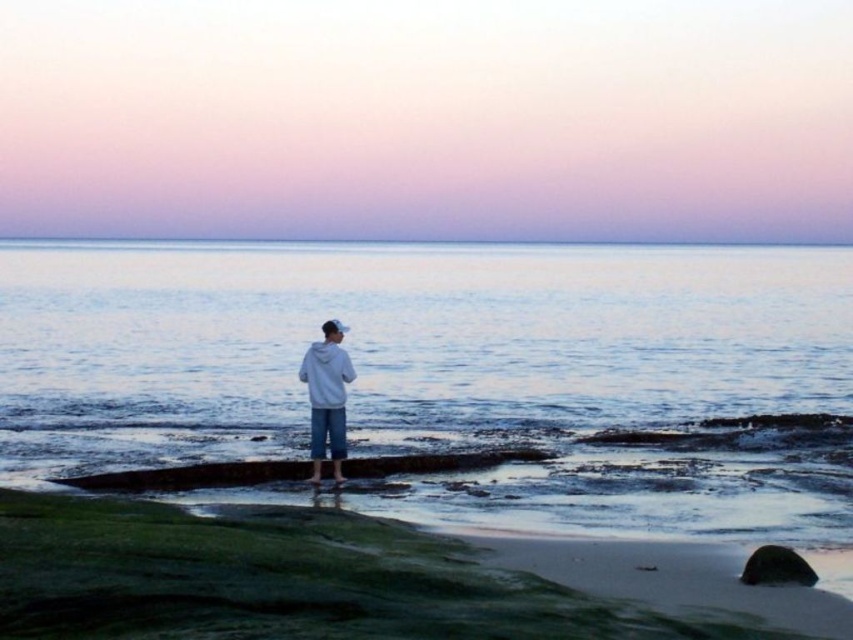
You are a photographer planning to take a picture of the blue water at center and the smooth gray rock at lower right. Which object should you focus on first if you want to capture both in the same frame without moving the camera?

The blue water at center is above the smooth gray rock at lower right, so you should focus on the smooth gray rock at lower right first to ensure both are in focus since it is closer to the camera.

You are a photographer trying to capture the entire scene of the blue water at center and the white matte hoodie at center in one shot. Based on their sizes, which object would appear larger in the photo?

The blue water at center would appear larger in the photo because its width is larger than that of the white matte hoodie at center.

You are standing on the rocky outcrop and see the blue water at center and the white matte hoodie at center. Which object is positioned to the right of the other?

The blue water at center is to the right of the white matte hoodie at center.